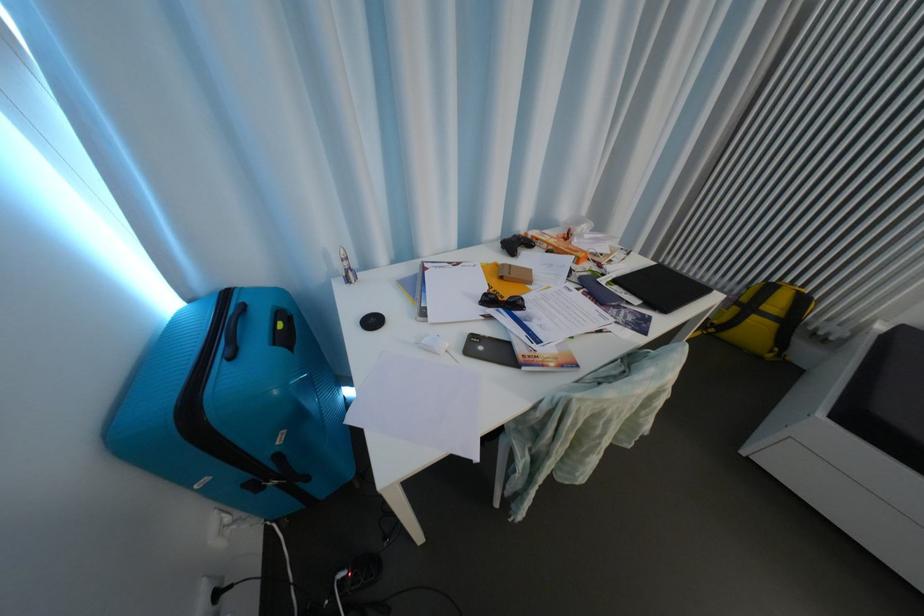
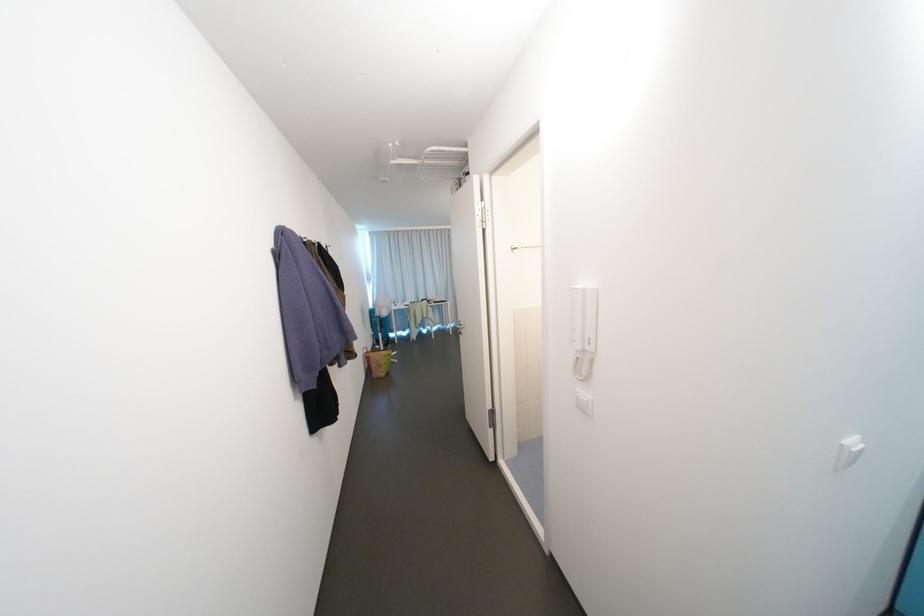
Locate, in the second image, the point that corresponds to point (375, 265) in the first image.

(406, 304)